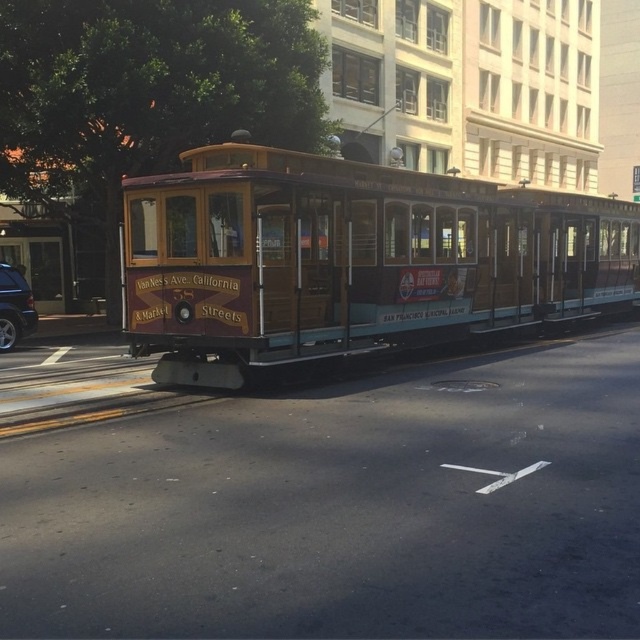
You are a pedestrian standing on the sidewalk next to the wooden cable car at center and the shiny black suv at left. Which vehicle is closer to the crosswalk?

The wooden cable car at center is positioned on the right side of the shiny black suv at left, so the shiny black suv at left is closer to the crosswalk.

You are a pedestrian standing on the sidewalk. You see the wooden cable car at center and the shiny black suv at left. Which vehicle is nearer to you?

The wooden cable car at center is closer to the viewer than the shiny black suv at left, so the wooden cable car at center is nearer to you.